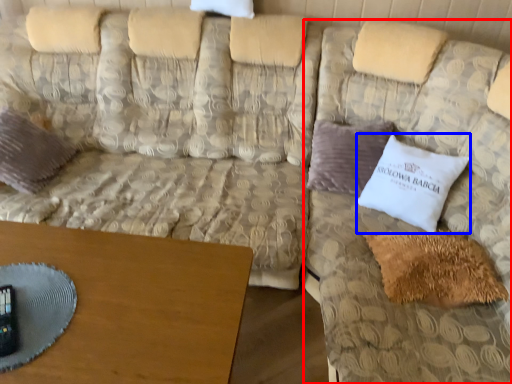
Question: Which object appears closest to the camera in this image, couch (highlighted by a red box) or pillow (highlighted by a blue box)?

Choices:
 (A) couch
 (B) pillow

Answer: (A)